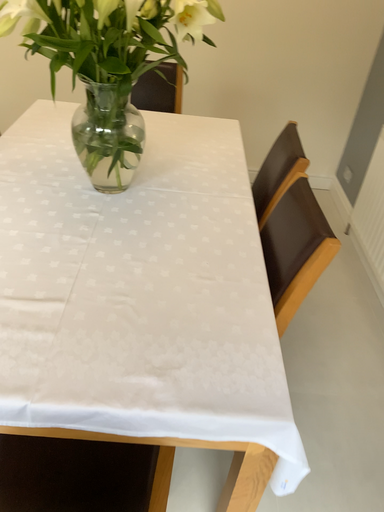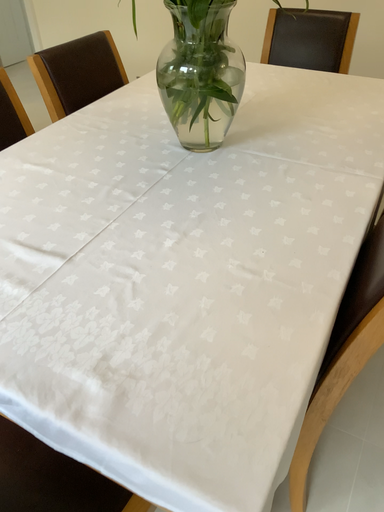
Question: How did the camera likely rotate when shooting the video?

Choices:
 (A) rotated right
 (B) rotated left

Answer: (B)